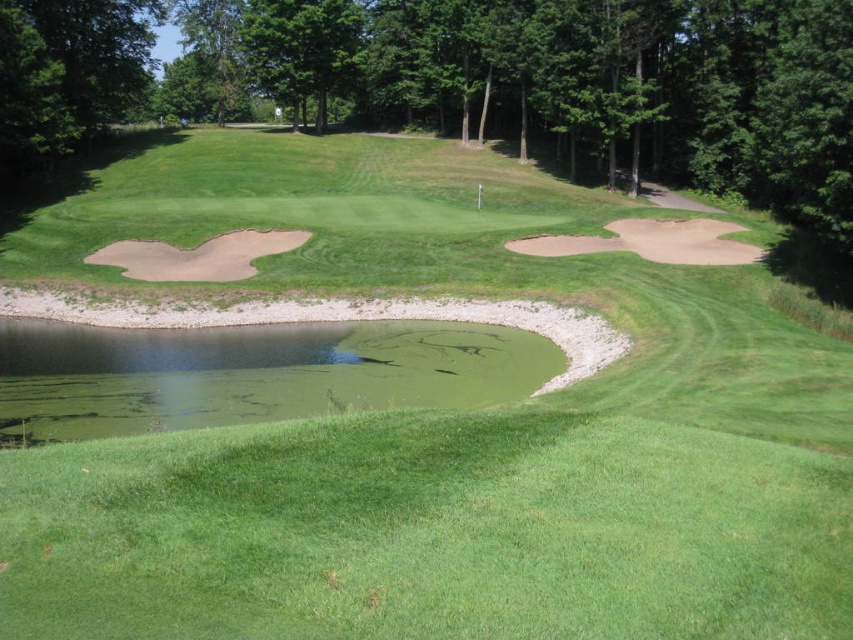
Question: Does green algae water at center lie behind sandy brown sand trap at left?

Choices:
 (A) yes
 (B) no

Answer: (B)

Question: Where is green algae water at center located in relation to sandy brown sand trap at left in the image?

Choices:
 (A) right
 (B) left

Answer: (A)

Question: Is green algae water at center to the left of sandy brown sand trap at left from the viewer's perspective?

Choices:
 (A) no
 (B) yes

Answer: (A)

Question: Which object appears closest to the camera in this image?

Choices:
 (A) sandy brown sand trap at left
 (B) green algae water at center

Answer: (B)